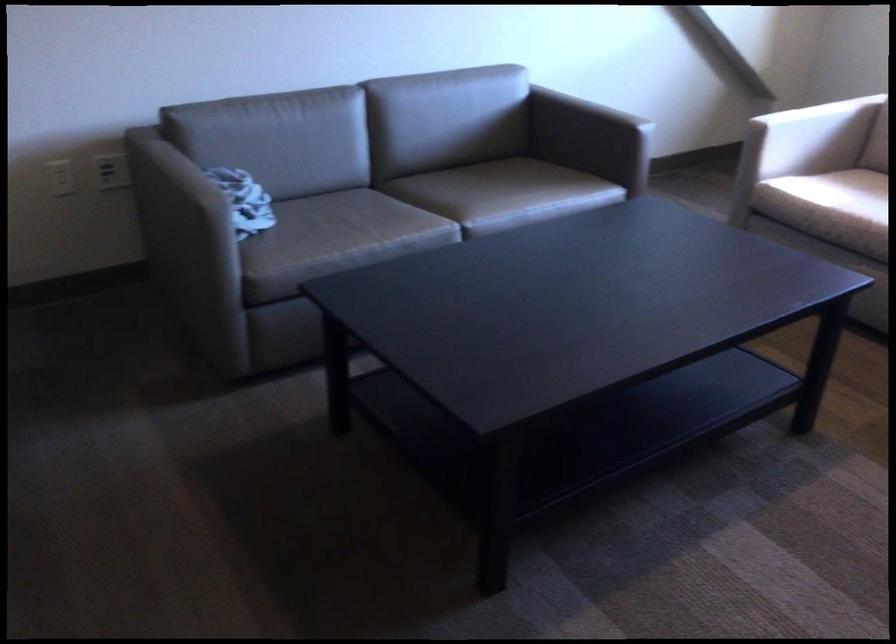
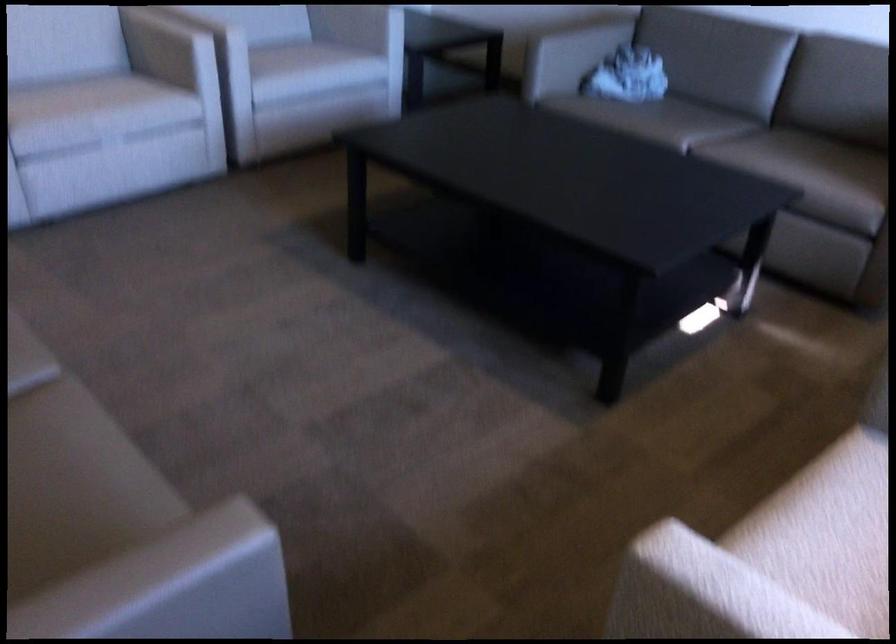
Find the pixel in the second image that matches point 400,200 in the first image.

(714, 127)